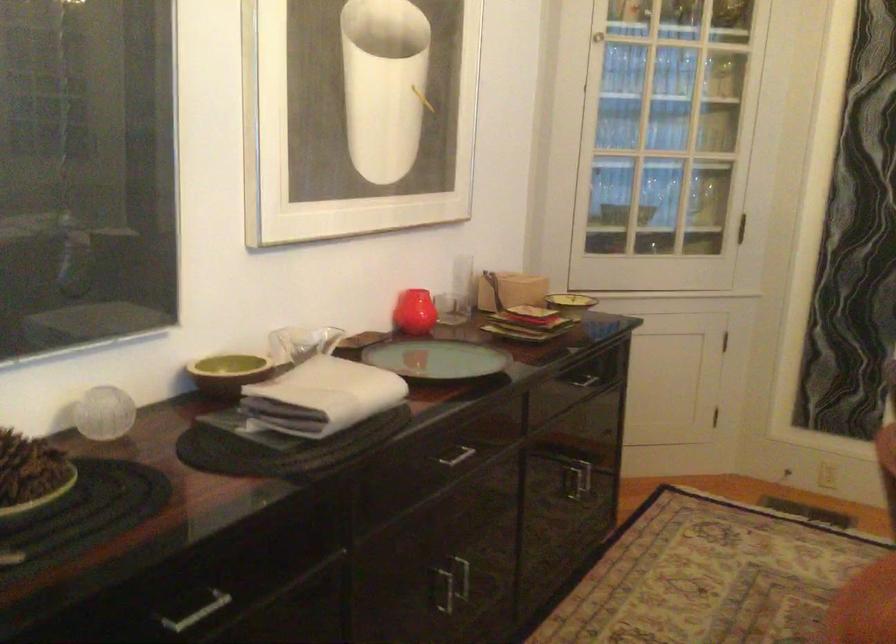
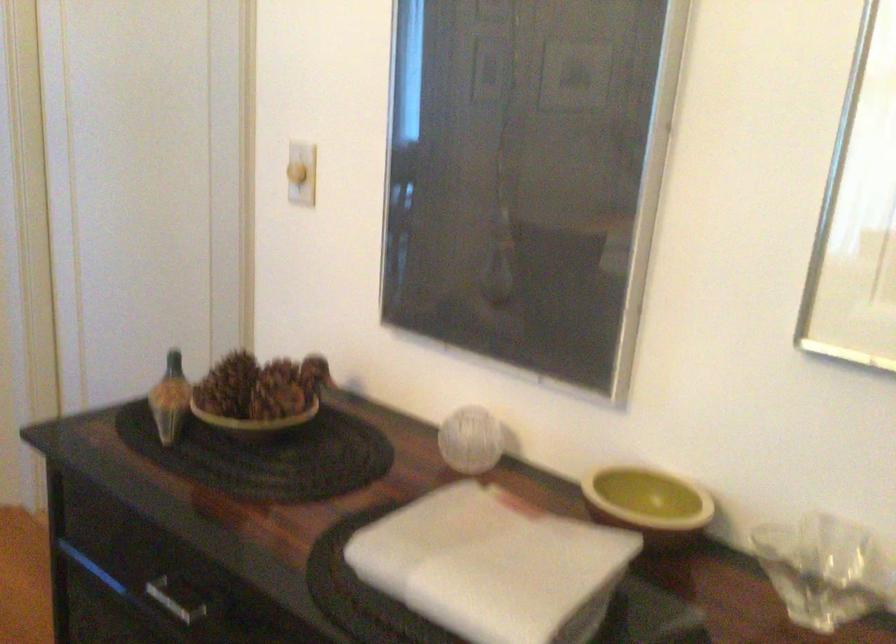
In the second image, find the point that corresponds to [228,402] in the first image.

(648, 503)